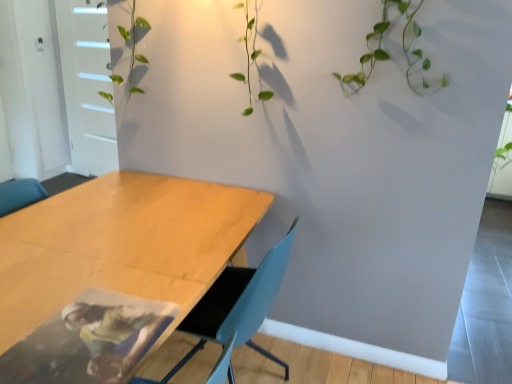
Question: Should I look upward or downward to see white matte door at upper left?

Choices:
 (A) down
 (B) up

Answer: (B)

Question: Considering the relative sizes of light blue plastic chair at center and white matte door at upper left in the image provided, is light blue plastic chair at center bigger than white matte door at upper left?

Choices:
 (A) yes
 (B) no

Answer: (B)

Question: From the image's perspective, is light blue plastic chair at center above white matte door at upper left?

Choices:
 (A) yes
 (B) no

Answer: (B)

Question: Can you confirm if light blue plastic chair at center is thinner than white matte door at upper left?

Choices:
 (A) yes
 (B) no

Answer: (B)

Question: From the image's perspective, is light blue plastic chair at center below white matte door at upper left?

Choices:
 (A) no
 (B) yes

Answer: (B)

Question: Is light blue plastic chair at center closer to the viewer compared to white matte door at upper left?

Choices:
 (A) yes
 (B) no

Answer: (A)

Question: Can you confirm if light blue plastic chair at center is smaller than white matte door at upper left?

Choices:
 (A) no
 (B) yes

Answer: (B)

Question: From a real-world perspective, is white matte door at upper left located higher than light blue plastic chair at center?

Choices:
 (A) yes
 (B) no

Answer: (A)

Question: Is white matte door at upper left located outside light blue plastic chair at center?

Choices:
 (A) no
 (B) yes

Answer: (B)

Question: From the image's perspective, is white matte door at upper left below light blue plastic chair at center?

Choices:
 (A) no
 (B) yes

Answer: (A)

Question: Is white matte door at upper left positioned far away from light blue plastic chair at center?

Choices:
 (A) no
 (B) yes

Answer: (B)

Question: From a real-world perspective, is white matte door at upper left positioned under light blue plastic chair at center based on gravity?

Choices:
 (A) yes
 (B) no

Answer: (B)

Question: Does white matte door at upper left contain light blue plastic chair at center?

Choices:
 (A) yes
 (B) no

Answer: (B)

Question: Is white matte door at upper left oriented towards wooden table at lower left?

Choices:
 (A) yes
 (B) no

Answer: (B)